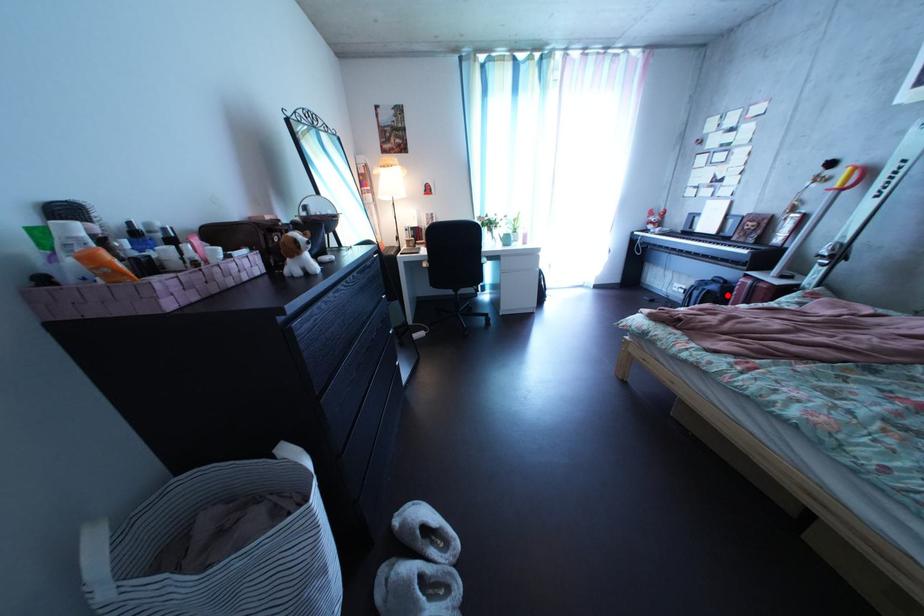
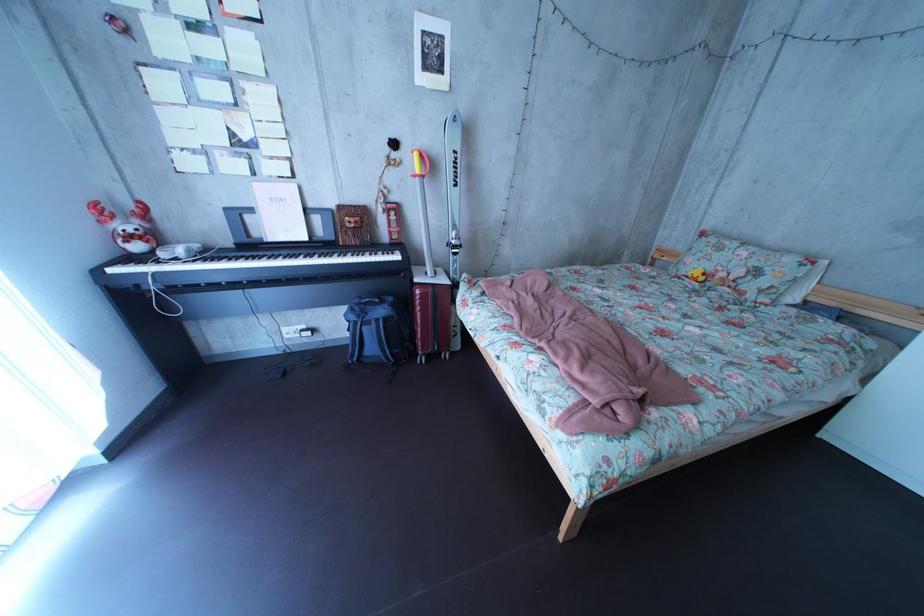
Find the pixel in the second image that matches the highlighted location in the first image.

(395, 320)